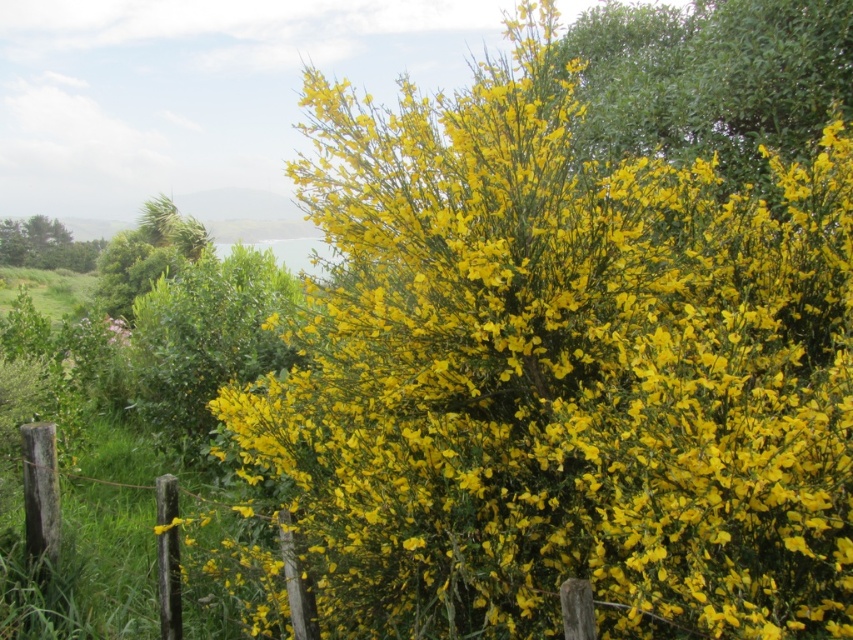
Who is positioned more to the left, yellow-green leafy bush at upper right or green leafy bush at left?

green leafy bush at left

Does yellow-green leafy bush at upper right have a greater height compared to green leafy bush at left?

Yes, yellow-green leafy bush at upper right is taller than green leafy bush at left.

Which is behind, point (804, 20) or point (32, 218)?

The point (32, 218) is behind.

At what (x,y) coordinates should I click in order to perform the action: click on yellow-green leafy bush at upper right. Please return your answer as a coordinate pair (x, y). This screenshot has height=640, width=853. Looking at the image, I should click on (712, 81).